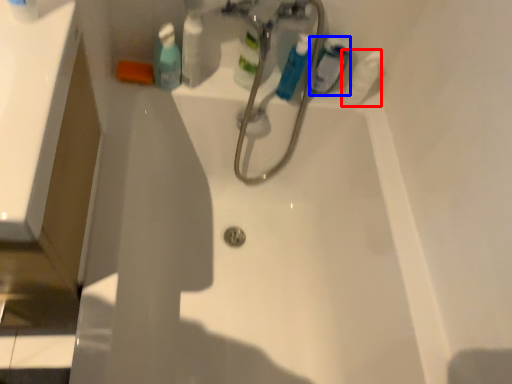
Question: Among these objects, which one is farthest to the camera, cleaning product (highlighted by a red box) or mouthwash (highlighted by a blue box)?

Choices:
 (A) cleaning product
 (B) mouthwash

Answer: (A)